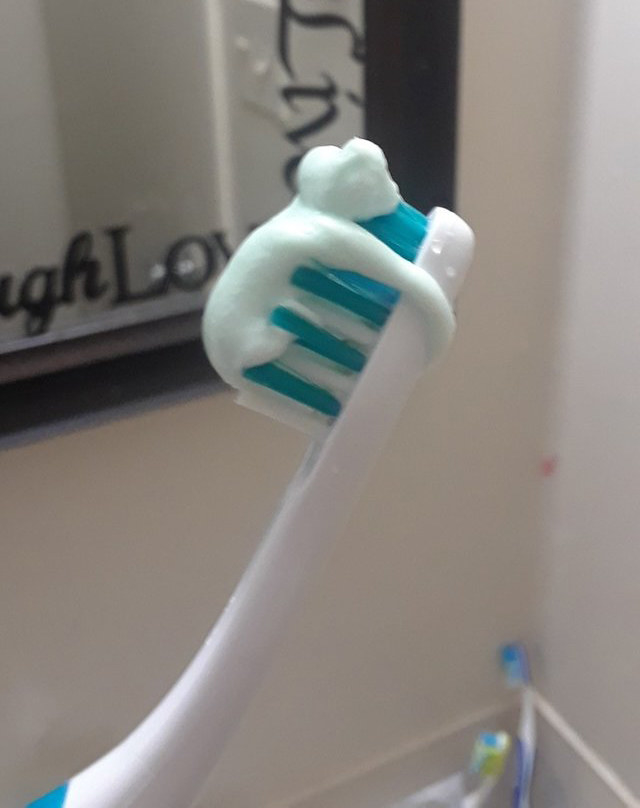
At what (x,y) coordinates should I click in order to perform the action: click on wall. Please return your answer as a coordinate pair (x, y). Looking at the image, I should click on (394, 533).